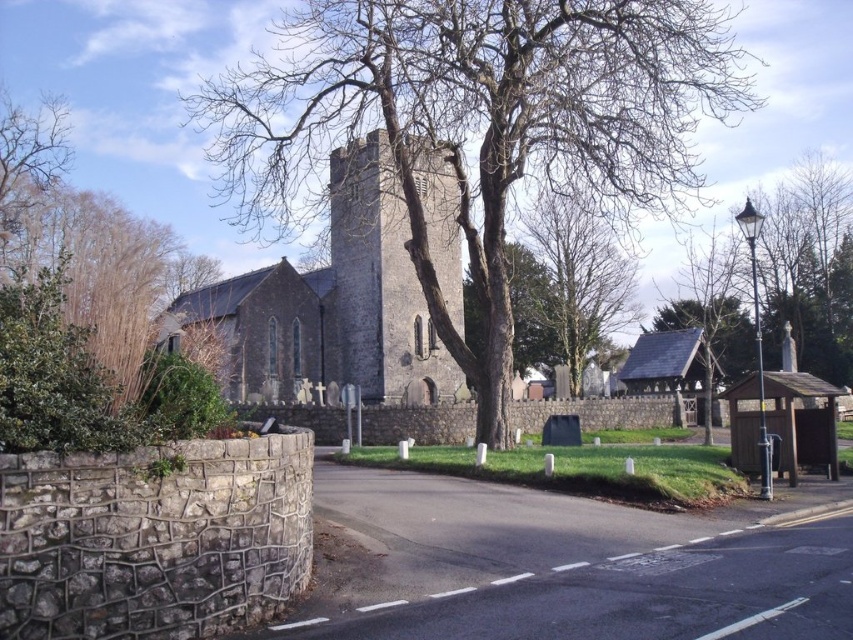
You are standing on the paved road in front of the church and notice two plants in the scene. Which one is taller between the bare branches at center and the green leafy shrub at left?

The bare branches at center is taller than the green leafy shrub at left.

You are a hiker standing on the paved road in front of the church. You notice a green leafy shrub at left and bare branches at center. Which object is closer to you?

The bare branches at center are closer to you because the green leafy shrub at left is behind them.